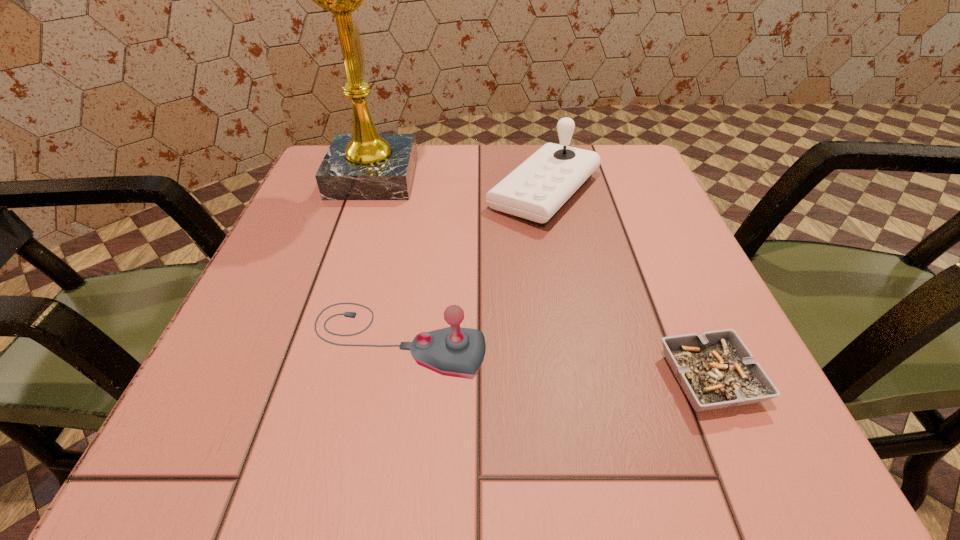
At what (x,y) coordinates should I click in order to perform the action: click on vacant area that lies between the taller joystick and the nearer joystick. Please return your answer as a coordinate pair (x, y). Looking at the image, I should click on (470, 266).

Image resolution: width=960 pixels, height=540 pixels. Find the location of `empty space between the left joystick and the right joystick`. empty space between the left joystick and the right joystick is located at coordinates (470, 266).

In order to click on vacant space that is in between the tallest object and the shortest object in this screenshot , I will do `click(541, 278)`.

This screenshot has width=960, height=540. Identify the location of free space that is in between the tallest object and the ashtray. (541, 278).

You are a GUI agent. You are given a task and a screenshot of the screen. Output one action in this format:
    pyautogui.click(x=<x>, y=<y>)
    Task: Click on the vacant area that lies between the left joystick and the shortest object
    
    Given the screenshot: What is the action you would take?
    pyautogui.click(x=554, y=359)

The width and height of the screenshot is (960, 540). Identify the location of object that is the second closest to the ashtray. (536, 190).

This screenshot has height=540, width=960. Find the location of `object that ranks as the closest to the shortest object`. object that ranks as the closest to the shortest object is located at coordinates (454, 351).

I want to click on vacant space that satisfies the following two spatial constraints: 1. on the front-facing side of the award; 2. on the right side of the second shortest object, so click(320, 340).

The height and width of the screenshot is (540, 960). In order to click on vacant space that satisfies the following two spatial constraints: 1. on the front side of the nearer joystick; 2. on the right side of the shortest object in this screenshot , I will do `click(391, 379)`.

This screenshot has width=960, height=540. In order to click on vacant space that satisfies the following two spatial constraints: 1. on the front-facing side of the award; 2. on the right side of the shortest object in this screenshot , I will do `click(307, 379)`.